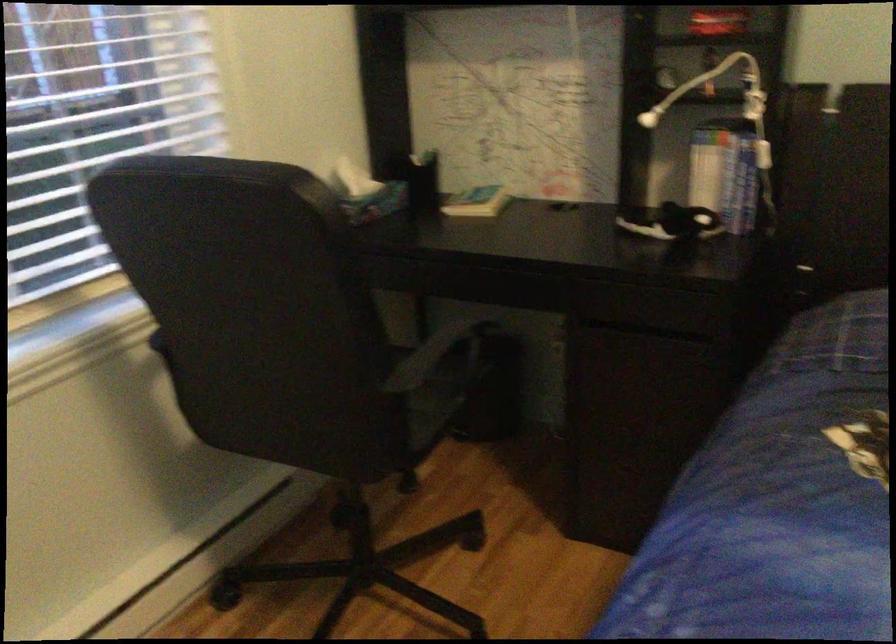
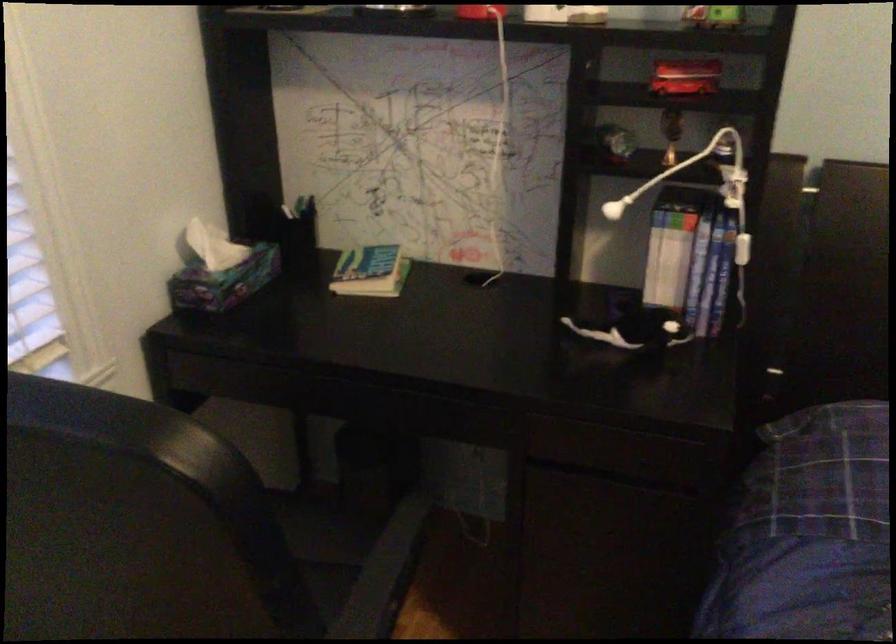
Question: The camera is either moving clockwise (left) or counter-clockwise (right) around the object. The first image is from the beginning of the video and the second image is from the end. Is the camera moving left or right when shooting the video?

Choices:
 (A) Left
 (B) Right

Answer: (A)